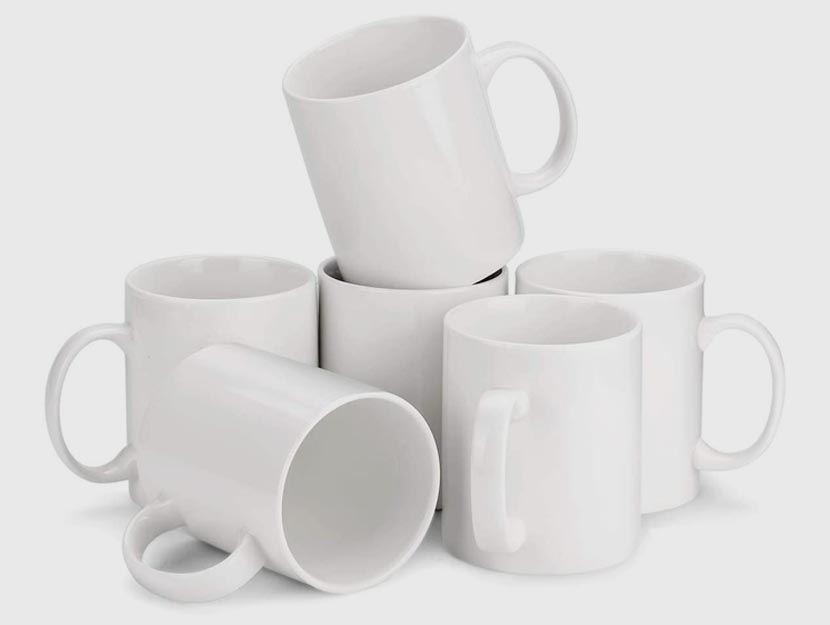
I want to click on white coffee cups, so click(x=403, y=232), click(x=384, y=328), click(x=261, y=310), click(x=685, y=331), click(x=581, y=400), click(x=259, y=440).